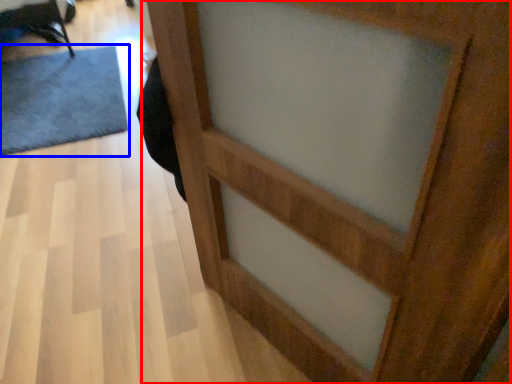
Question: Which object appears farthest to the camera in this image, barn door (highlighted by a red box) or doormat (highlighted by a blue box)?

Choices:
 (A) barn door
 (B) doormat

Answer: (B)